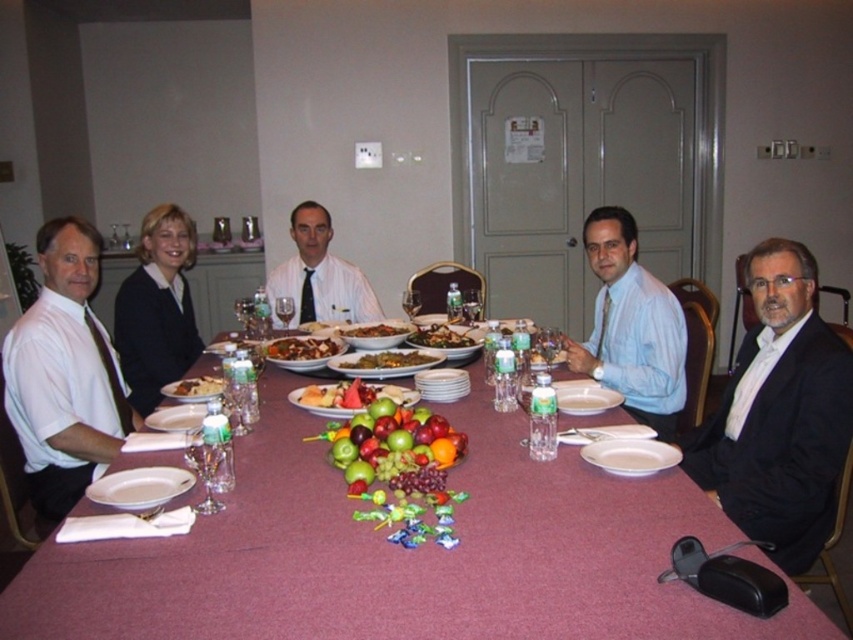
Who is taller, matte white shirt at center or white glossy plate at lower left?

Standing taller between the two is matte white shirt at center.

Who is higher up, matte white shirt at center or white glossy plate at lower left?

Positioned higher is matte white shirt at center.

Is point (329, 301) farther from viewer compared to point (158, 488)?

Yes, point (329, 301) is behind point (158, 488).

Identify the location of matte white shirt at center. The image size is (853, 640). (320, 275).

Can you confirm if black suit at right is smaller than green leafy vegetables at center?

No, black suit at right is not smaller than green leafy vegetables at center.

Between point (807, 477) and point (439, 340), which one is positioned in front?

Point (807, 477) is more forward.

This screenshot has height=640, width=853. Identify the location of black suit at right. [779, 413].

Based on the photo, is black suit at right above sliced fruit at center?

Actually, black suit at right is below sliced fruit at center.

Which is more to the right, black suit at right or sliced fruit at center?

black suit at right is more to the right.

Which is behind, point (787, 426) or point (364, 388)?

The point (364, 388) is behind.

At what (x,y) coordinates should I click in order to perform the action: click on black suit at right. Please return your answer as a coordinate pair (x, y). Looking at the image, I should click on (779, 413).